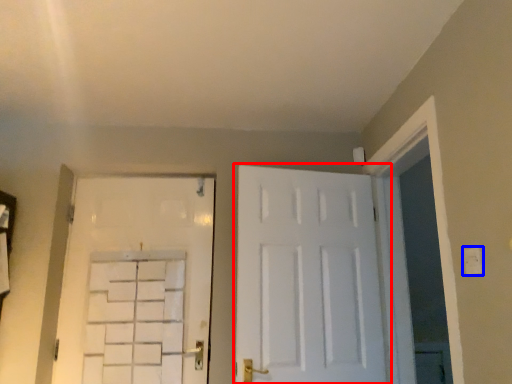
Question: Which point is closer to the camera, door (highlighted by a red box) or electric outlet (highlighted by a blue box)?

Choices:
 (A) door
 (B) electric outlet

Answer: (B)